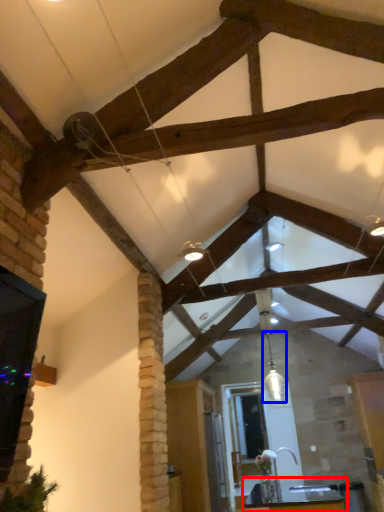
Question: Which object is further to the camera taking this photo, table (highlighted by a red box) or light fixture (highlighted by a blue box)?

Choices:
 (A) table
 (B) light fixture

Answer: (B)